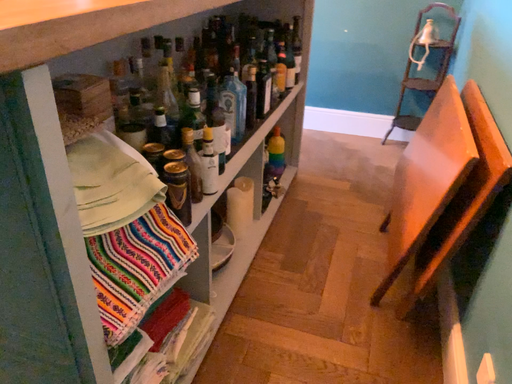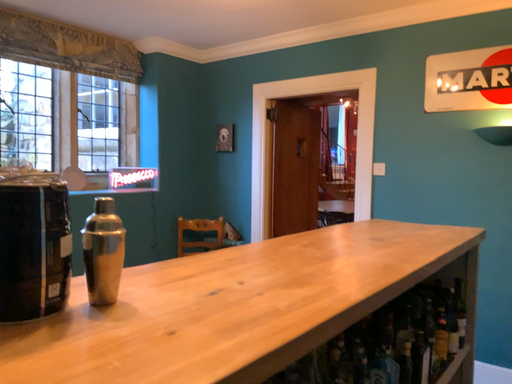
Question: How did the camera likely rotate when shooting the video?

Choices:
 (A) rotated upward
 (B) rotated downward

Answer: (A)